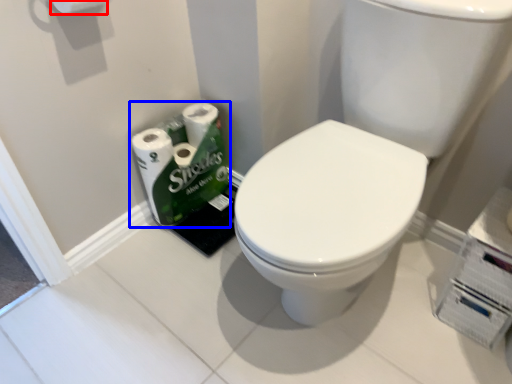
Question: Which point is further to the camera, toilet paper (highlighted by a red box) or toilet paper (highlighted by a blue box)?

Choices:
 (A) toilet paper
 (B) toilet paper

Answer: (B)